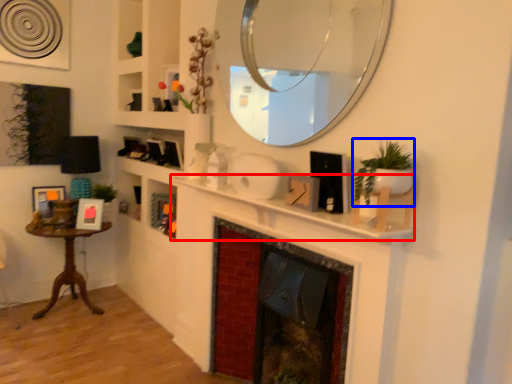
Question: Which of the following is the closest to the observer, mantle (highlighted by a red box) or plant (highlighted by a blue box)?

Choices:
 (A) mantle
 (B) plant

Answer: (B)